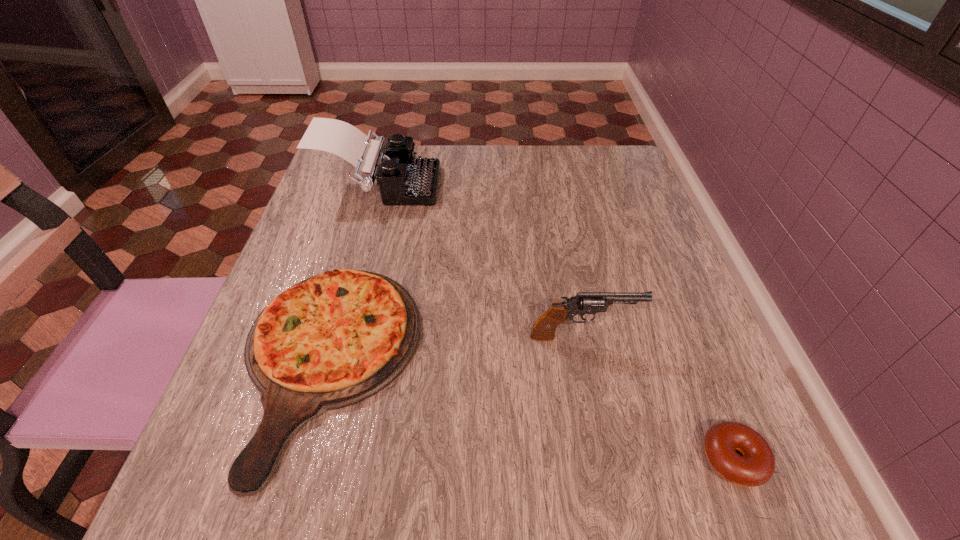
Identify the location of free space that satisfies the following two spatial constraints: 1. on the keys of the doughnut; 2. on the right side of the typewriter. (305, 458).

Locate an element on the screen. The height and width of the screenshot is (540, 960). free point that satisfies the following two spatial constraints: 1. along the barrel of the third object from left to right; 2. on the back side of the doughnut is located at coordinates (608, 458).

Locate an element on the screen. free space that satisfies the following two spatial constraints: 1. along the barrel of the third shortest object; 2. on the front side of the third tallest object is located at coordinates (588, 364).

Where is `vacant region that satisfies the following two spatial constraints: 1. on the keys of the typewriter; 2. on the right side of the shortest object`? The height and width of the screenshot is (540, 960). vacant region that satisfies the following two spatial constraints: 1. on the keys of the typewriter; 2. on the right side of the shortest object is located at coordinates (305, 458).